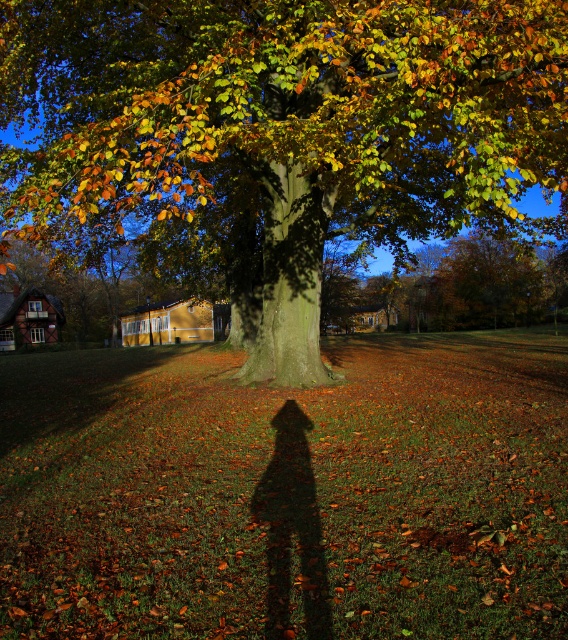
You are standing in an autumn forest and see the green rough bark tree at center and the green leafy tree at upper center. Which tree would appear larger in your field of view?

The green rough bark tree at center appears larger in your field of view because it is closer to you than the green leafy tree at upper center.

You are standing in the autumnal scene described. You see a point marked at coordinates (286,124). Which object from the scene does this point lie on?

The point at coordinates (286,124) lies on the green rough bark tree at center.

You are standing in an autumn forest and see the green rough bark tree at center and the green leafy tree at upper center. Which tree is shorter?

The green rough bark tree at center is shorter than the green leafy tree at upper center.